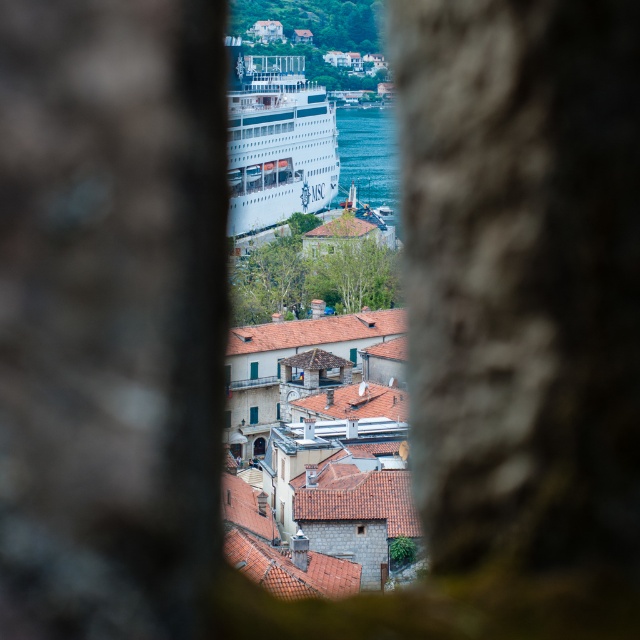
Question: Is blue water at center closer to the viewer compared to green glass window at center?

Choices:
 (A) yes
 (B) no

Answer: (B)

Question: Which is farther from the white glossy cruise ship at center?

Choices:
 (A) green glass window at center
 (B) blue glass window at center

Answer: (B)

Question: Does blue glass window at center appear on the left side of green glass window at center?

Choices:
 (A) no
 (B) yes

Answer: (B)

Question: Which is nearer to the white glossy cruise ship at center?

Choices:
 (A) blue glass window at center
 (B) green glass window at center

Answer: (B)

Question: Does blue water at center have a greater width compared to green glass window at center?

Choices:
 (A) yes
 (B) no

Answer: (A)

Question: Which of the following is the farthest from the observer?

Choices:
 (A) (394, 157)
 (B) (257, 372)
 (C) (260, 76)
 (D) (253, 408)

Answer: (A)